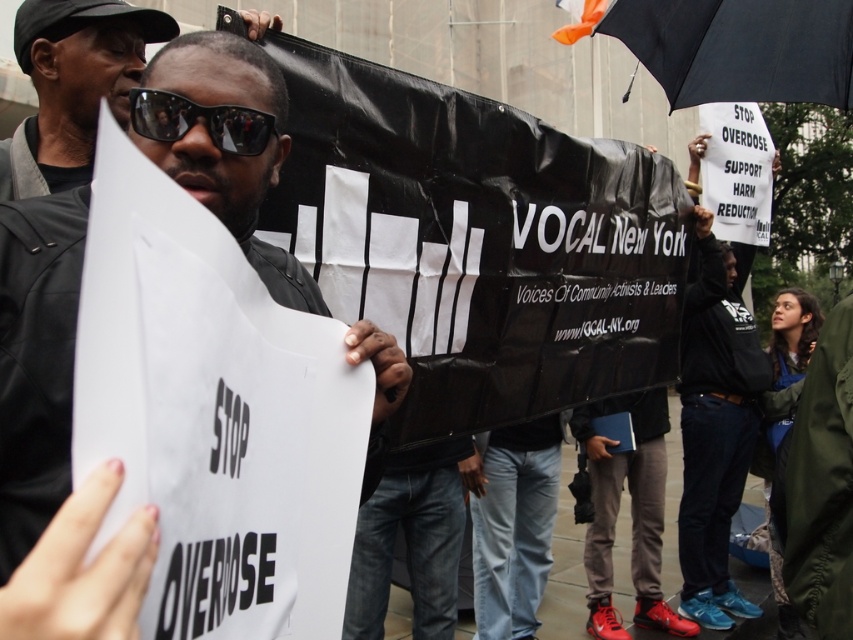
Who is positioned more to the right, black matte umbrella at upper right or sunglasses at center?

Positioned to the right is black matte umbrella at upper right.

Who is more distant from viewer, (665, 38) or (207, 124)?

The point (665, 38) is behind.

Is point (631, 10) positioned after point (193, 112)?

Yes, it is behind point (193, 112).

Where is `black matte umbrella at upper right`? This screenshot has height=640, width=853. black matte umbrella at upper right is located at coordinates (740, 49).

Can you confirm if black leather jacket at center is positioned above matte black sunglasses at center?

Incorrect, black leather jacket at center is not positioned above matte black sunglasses at center.

The width and height of the screenshot is (853, 640). Describe the element at coordinates (35, 362) in the screenshot. I see `black leather jacket at center` at that location.

Find the location of a particular element. The width and height of the screenshot is (853, 640). black leather jacket at center is located at coordinates (35, 362).

Which is behind, point (189, 170) or point (138, 120)?

Positioned behind is point (138, 120).

Can you confirm if black leather jacket at center is smaller than sunglasses at center?

No.

Is point (283, 96) positioned in front of point (161, 108)?

No, (283, 96) is behind (161, 108).

Identify the location of black leather jacket at center. The width and height of the screenshot is (853, 640). (35, 362).